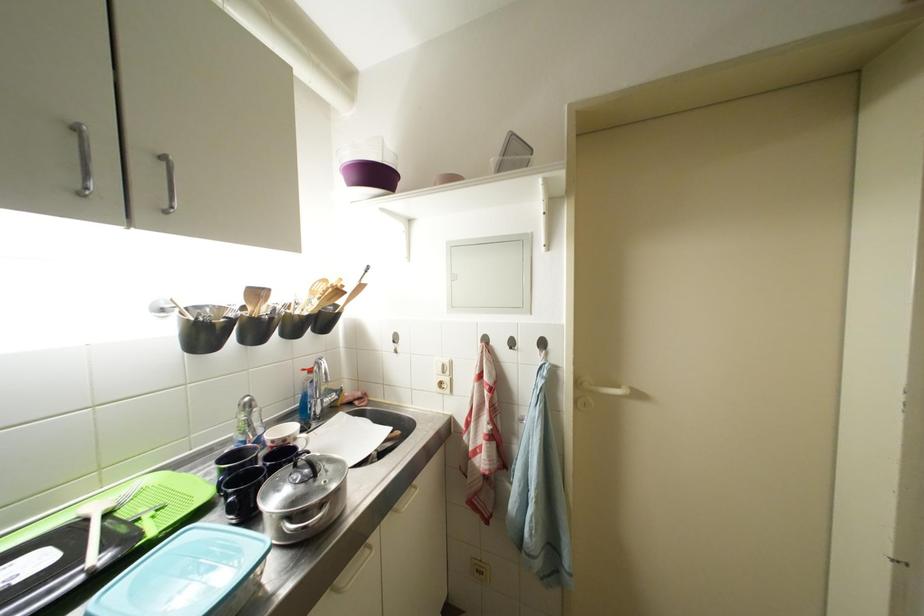
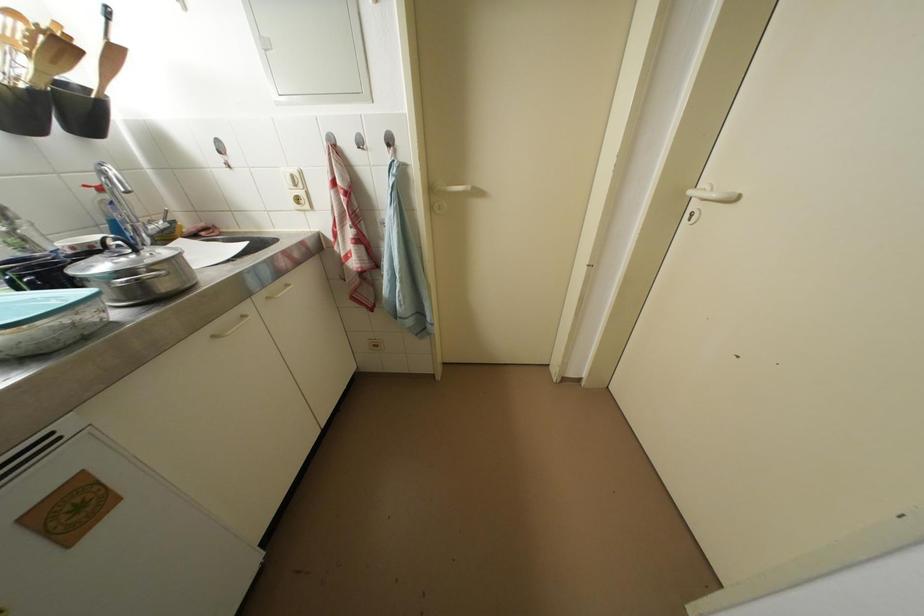
Where in the second image is the point corresponding to (x=368, y=291) from the first image?

(120, 55)